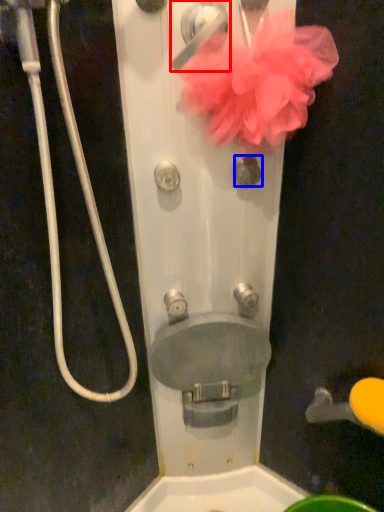
Question: Which point is closer to the camera, door handle (highlighted by a red box) or knob (highlighted by a blue box)?

Choices:
 (A) door handle
 (B) knob

Answer: (A)